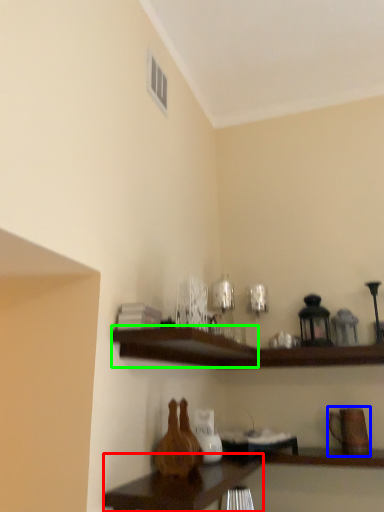
Question: Based on their relative distances, which object is farther from table (highlighted by a red box)? Choose from pottery (highlighted by a blue box) and shelf (highlighted by a green box).

Choices:
 (A) pottery
 (B) shelf

Answer: (A)